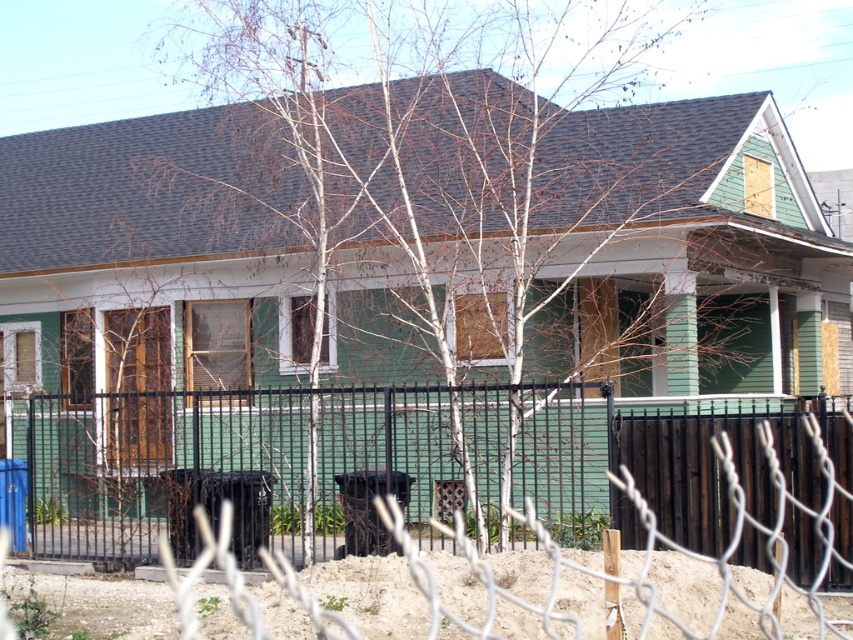
Question: Does black metal fence at center have a greater width compared to dark brown wood fence at center?

Choices:
 (A) yes
 (B) no

Answer: (B)

Question: Does black metal fence at center appear under dark brown wood fence at center?

Choices:
 (A) no
 (B) yes

Answer: (B)

Question: Which point is closer to the camera?

Choices:
 (A) black metal fence at center
 (B) dark brown wood fence at center

Answer: (B)

Question: Can you confirm if black metal fence at center is positioned to the left of dark brown wood fence at center?

Choices:
 (A) no
 (B) yes

Answer: (B)